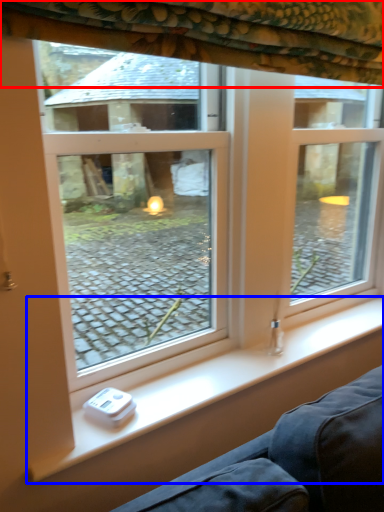
Question: Which of the following is the closest to the observer, curtain (highlighted by a red box) or window sill (highlighted by a blue box)?

Choices:
 (A) curtain
 (B) window sill

Answer: (A)